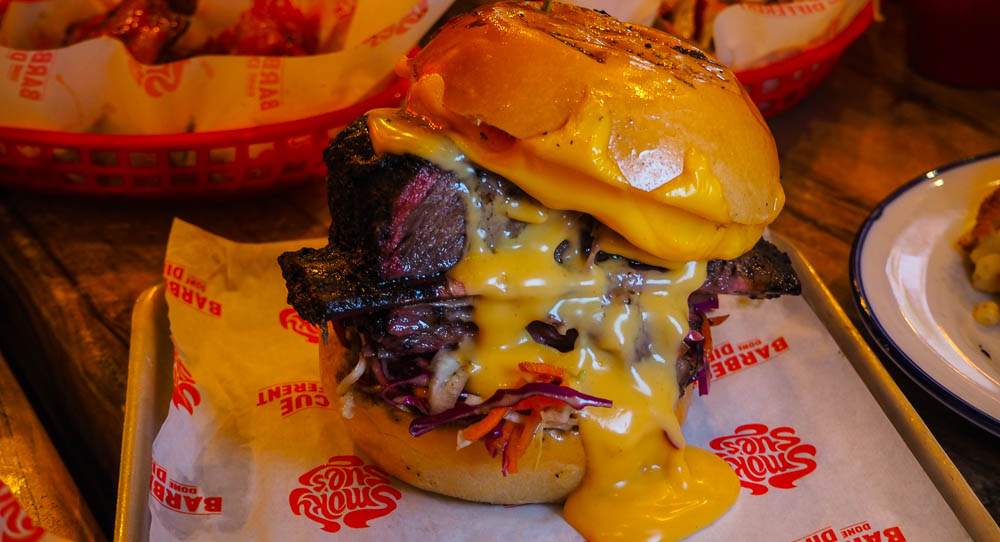
You are a GUI agent. You are given a task and a screenshot of the screen. Output one action in this format:
    pyautogui.click(x=<x>, y=<y>)
    Task: Click on the baking sheet
    The width and height of the screenshot is (1000, 542).
    Given the screenshot: What is the action you would take?
    pyautogui.click(x=134, y=418)